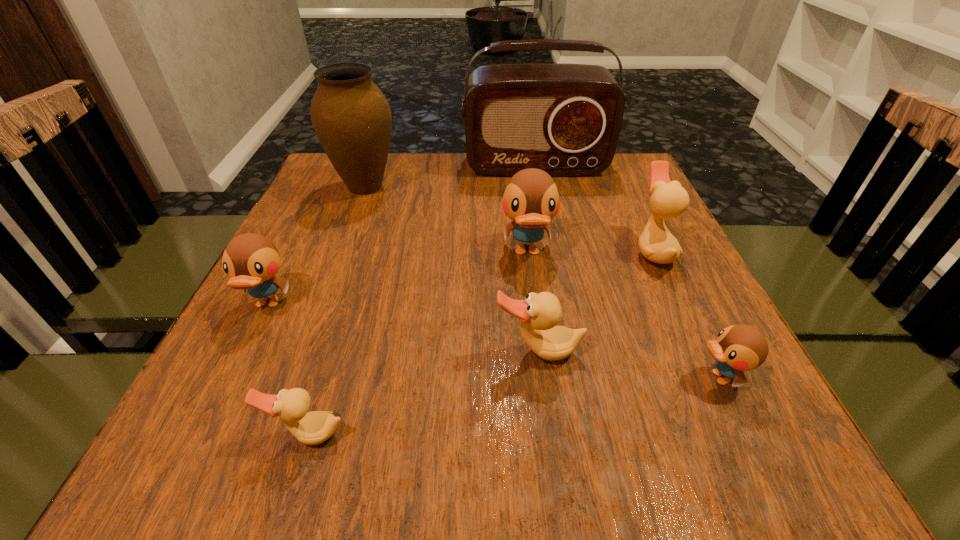
At what (x,y) coordinates should I click in order to perform the action: click on object at the far left corner. Please return your answer as a coordinate pair (x, y). The width and height of the screenshot is (960, 540). Looking at the image, I should click on (352, 118).

Locate an element on the screen. This screenshot has height=540, width=960. object situated at the near left corner is located at coordinates (311, 428).

The image size is (960, 540). Find the location of `object that is at the far right corner`. object that is at the far right corner is located at coordinates (565, 119).

This screenshot has width=960, height=540. I want to click on blank space at the far edge, so click(420, 179).

In the image, there is a desktop. Identify the location of vacant area at the near edge. This screenshot has height=540, width=960. (500, 463).

The image size is (960, 540). In order to click on vacant space at the left edge of the desktop in this screenshot , I will do `click(306, 312)`.

In the image, there is a desktop. At what (x,y) coordinates should I click in order to perform the action: click on vacant space at the right edge. Please return your answer as a coordinate pair (x, y). Image resolution: width=960 pixels, height=540 pixels. Looking at the image, I should click on (620, 244).

Identify the location of vacant space at the far left corner of the desktop. (325, 160).

In the image, there is a desktop. Where is `vacant space at the far right corner`? The height and width of the screenshot is (540, 960). vacant space at the far right corner is located at coordinates (632, 174).

In order to click on free region at the near right corner of the desktop in this screenshot , I will do `click(753, 465)`.